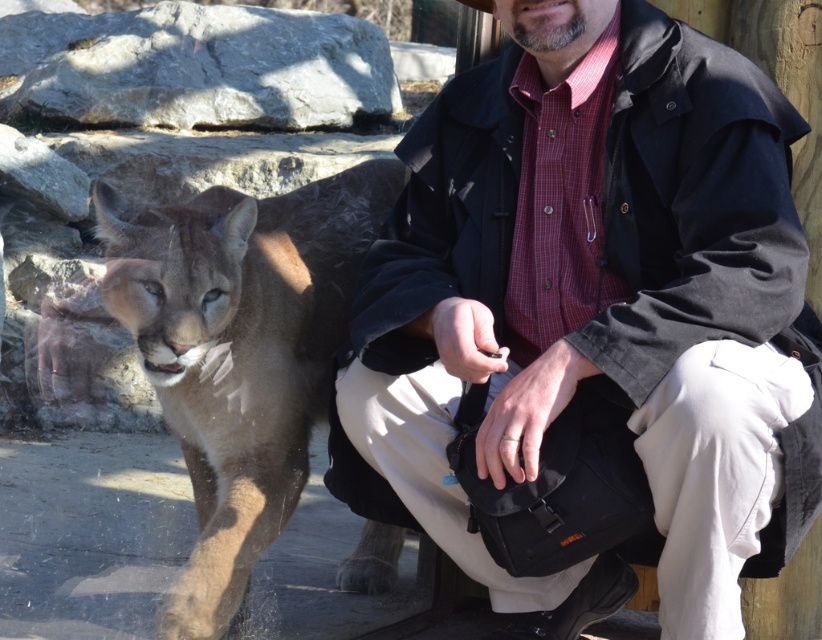
Based on the scene description, if the man wants to move closer to the brown fur cougar at left without getting too close to the matte black jacket at center, which direction should he move?

The matte black jacket at center is to the right of the brown fur cougar at left. To move closer to the brown fur cougar at left while avoiding the matte black jacket at center, the man should move to the left.

Looking at this image, what are the coordinates of the matte black jacket at center in the image?

The coordinates of the matte black jacket at center are at point (594,308).

You are a zookeeper planning to place a 1.5 meter tall safety barrier between the matte black jacket at center and the brown fur cougar at left. Considering their heights, will the barrier block the man from seeing the cougar?

The matte black jacket at center is much taller than the brown fur cougar at left. Since the barrier is 1.5 meters tall, the man might still see over it, but the cougar, being shorter, may have limited visibility. However, the question focuses on the man seeing the cougar. If the barrier is placed between them at 1.5m, and the man is taller, he could potentially look over the barrier to see the cougar. However, without exact heights, we can only infer based on relative sizes. Since the jacket is part of his